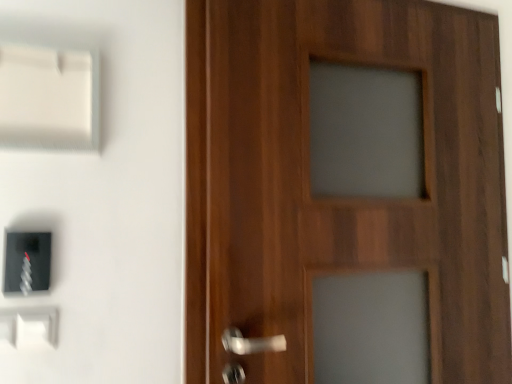
Question: Does wooden door at right have a smaller size compared to white plastic light switch at lower left, the third light switch from the top?

Choices:
 (A) yes
 (B) no

Answer: (B)

Question: Can you confirm if wooden door at right is wider than white plastic light switch at lower left, the first light switch positioned from the bottom?

Choices:
 (A) yes
 (B) no

Answer: (A)

Question: Is wooden door at right at the left side of white plastic light switch at lower left, the third light switch from the top?

Choices:
 (A) yes
 (B) no

Answer: (B)

Question: Are wooden door at right and white plastic light switch at lower left, the first light switch positioned from the bottom, making contact?

Choices:
 (A) no
 (B) yes

Answer: (A)

Question: Can you confirm if wooden door at right is taller than white plastic light switch at lower left, the first light switch positioned from the bottom?

Choices:
 (A) no
 (B) yes

Answer: (B)

Question: Is wooden door at right shorter than white plastic light switch at lower left, the third light switch from the top?

Choices:
 (A) yes
 (B) no

Answer: (B)

Question: From the image's perspective, would you say white plastic light switch at upper left, the third light switch when ordered from bottom to top, is shown under wooden door at right?

Choices:
 (A) no
 (B) yes

Answer: (A)

Question: Is white plastic light switch at upper left, the first light switch in the top-to-bottom sequence, facing towards wooden door at right?

Choices:
 (A) yes
 (B) no

Answer: (B)

Question: Is white plastic light switch at upper left, the first light switch in the top-to-bottom sequence, at the right side of wooden door at right?

Choices:
 (A) no
 (B) yes

Answer: (A)

Question: From the image's perspective, is white plastic light switch at upper left, the third light switch when ordered from bottom to top, located above wooden door at right?

Choices:
 (A) no
 (B) yes

Answer: (B)

Question: Is white plastic light switch at upper left, the first light switch in the top-to-bottom sequence, bigger than wooden door at right?

Choices:
 (A) no
 (B) yes

Answer: (A)

Question: Does white plastic light switch at upper left, the third light switch when ordered from bottom to top, come behind wooden door at right?

Choices:
 (A) no
 (B) yes

Answer: (A)

Question: Considering the relative sizes of white plastic light switch at lower left, the third light switch from the top, and wooden door at right in the image provided, is white plastic light switch at lower left, the third light switch from the top, smaller than wooden door at right?

Choices:
 (A) yes
 (B) no

Answer: (A)